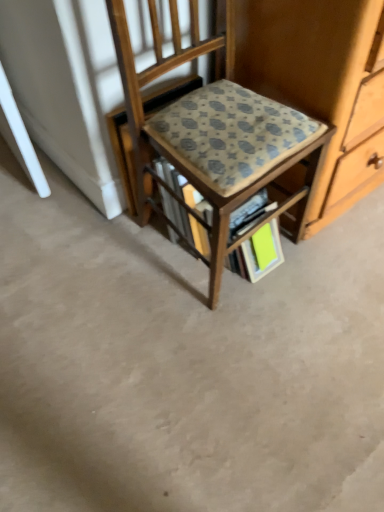
Question: Does point click(x=266, y=180) appear closer or farther from the camera than point click(x=266, y=249)?

Choices:
 (A) closer
 (B) farther

Answer: (A)

Question: Is patterned fabric chair at center taller or shorter than bright green paper at lower center?

Choices:
 (A) tall
 (B) short

Answer: (A)

Question: Which object is the farthest from the patterned fabric book at center?

Choices:
 (A) patterned fabric chair at center
 (B) bright green paper at lower center

Answer: (A)

Question: Estimate the real-world distances between objects in this image. Which object is closer to the patterned fabric book at center?

Choices:
 (A) patterned fabric chair at center
 (B) bright green paper at lower center

Answer: (B)